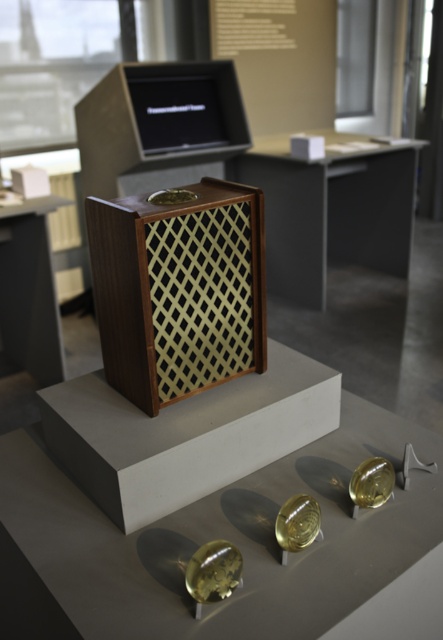
Is matte wood table at center positioned in front of matte black table at left?

No, matte wood table at center is behind matte black table at left.

Which is below, matte wood table at center or matte black table at left?

Positioned lower is matte black table at left.

Does point (341, 163) come closer to viewer compared to point (34, 288)?

No, it is not.

The width and height of the screenshot is (443, 640). I want to click on matte wood table at center, so click(330, 209).